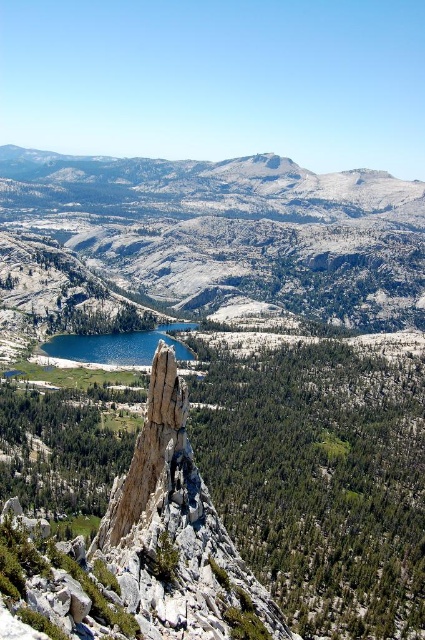
Question: Which of the following is the closest to the observer?

Choices:
 (A) (193, 227)
 (B) (90, 336)
 (C) (166, 429)

Answer: (C)

Question: Does snowy granite mountain at center appear over blue glassy lake at center?

Choices:
 (A) no
 (B) yes

Answer: (B)

Question: Based on their relative distances, which object is nearer to the blue glassy lake at center?

Choices:
 (A) smooth gray rock formation at center
 (B) snowy granite mountain at center

Answer: (A)

Question: Estimate the real-world distances between objects in this image. Which object is farther from the snowy granite mountain at center?

Choices:
 (A) blue glassy lake at center
 (B) smooth gray rock formation at center

Answer: (B)

Question: Considering the relative positions of snowy granite mountain at center and blue glassy lake at center in the image provided, where is snowy granite mountain at center located with respect to blue glassy lake at center?

Choices:
 (A) right
 (B) left

Answer: (A)

Question: Is snowy granite mountain at center closer to camera compared to blue glassy lake at center?

Choices:
 (A) yes
 (B) no

Answer: (B)